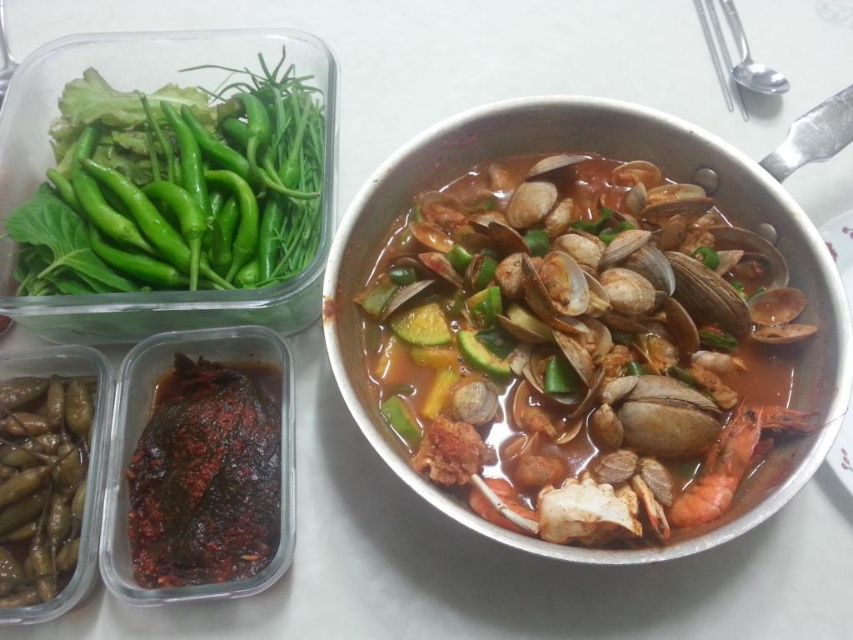
Does brown glossy clams at center appear on the right side of green glossy chili peppers at upper left?

Yes, brown glossy clams at center is to the right of green glossy chili peppers at upper left.

Is brown glossy clams at center to the left of green glossy chili peppers at upper left from the viewer's perspective?

In fact, brown glossy clams at center is to the right of green glossy chili peppers at upper left.

Between point (703, 250) and point (260, 269), which one is positioned behind?

The point (260, 269) is behind.

What are the coordinates of `brown glossy clams at center` in the screenshot? It's located at (581, 348).

Measure the distance from brown glossy clams at center to dark brown glossy fish at lower left.

They are 14.15 inches apart.

Is brown glossy clams at center thinner than dark brown glossy fish at lower left?

Incorrect, brown glossy clams at center's width is not less than dark brown glossy fish at lower left's.

Is point (682, 196) positioned after point (148, 582)?

Yes.

Identify the location of brown glossy clams at center. This screenshot has width=853, height=640. (581, 348).

Who is more forward, [38,269] or [28,509]?

Point [28,509] is more forward.

Measure the distance between green glossy chili peppers at upper left and camera.

green glossy chili peppers at upper left and camera are 38.58 inches apart from each other.

Identify the location of green glossy chili peppers at upper left. This screenshot has height=640, width=853. (173, 188).